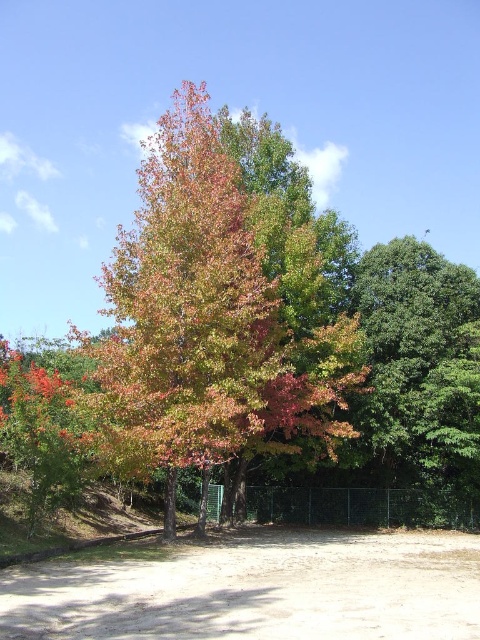
Can you confirm if multicolored foliage at center is thinner than green glossy tree at right?

No.

This screenshot has width=480, height=640. Describe the element at coordinates (211, 320) in the screenshot. I see `multicolored foliage at center` at that location.

What do you see at coordinates (211, 320) in the screenshot?
I see `multicolored foliage at center` at bounding box center [211, 320].

Identify the location of multicolored foliage at center. This screenshot has width=480, height=640. (211, 320).

Find the location of a particular element. multicolored foliage at center is located at coordinates (211, 320).

Does multicolored foliage at center appear under brown sandy dirt field at lower center?

No, multicolored foliage at center is not below brown sandy dirt field at lower center.

Is point (132, 451) in front of point (224, 625)?

No.

Find the location of a particular element. multicolored foliage at center is located at coordinates (211, 320).

Is the position of brown sandy dirt field at lower center less distant than that of green glossy tree at right?

Yes, it is.

Looking at this image, can you confirm if brown sandy dirt field at lower center is positioned below green glossy tree at right?

Yes, brown sandy dirt field at lower center is below green glossy tree at right.

Identify the location of brown sandy dirt field at lower center. The height and width of the screenshot is (640, 480). (255, 589).

Where is `brown sandy dirt field at lower center`? brown sandy dirt field at lower center is located at coordinates (255, 589).